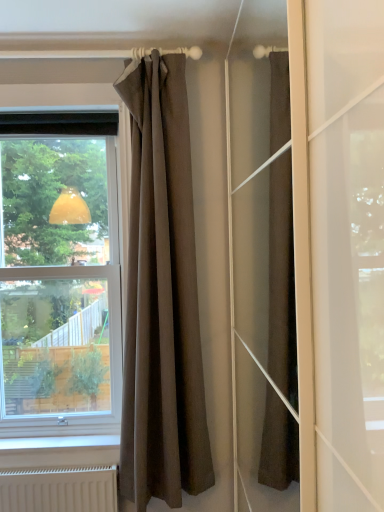
Question: Looking at their shapes, would you say transparent glass window at left is wider or thinner than brown textured curtain at upper center?

Choices:
 (A) thin
 (B) wide

Answer: (B)

Question: Visually, is transparent glass window at left positioned to the left or to the right of brown textured curtain at upper center?

Choices:
 (A) left
 (B) right

Answer: (A)

Question: Is transparent glass window at left bigger or smaller than brown textured curtain at upper center?

Choices:
 (A) big
 (B) small

Answer: (A)

Question: From the image's perspective, relative to transparent glass window at left, is brown textured curtain at upper center above or below?

Choices:
 (A) above
 (B) below

Answer: (B)

Question: Looking at the image, does brown textured curtain at upper center seem bigger or smaller compared to transparent glass window at left?

Choices:
 (A) big
 (B) small

Answer: (B)

Question: In the image, is brown textured curtain at upper center on the left side or the right side of transparent glass window at left?

Choices:
 (A) left
 (B) right

Answer: (B)

Question: Considering the positions of brown textured curtain at upper center and transparent glass window at left in the image, is brown textured curtain at upper center taller or shorter than transparent glass window at left?

Choices:
 (A) tall
 (B) short

Answer: (A)